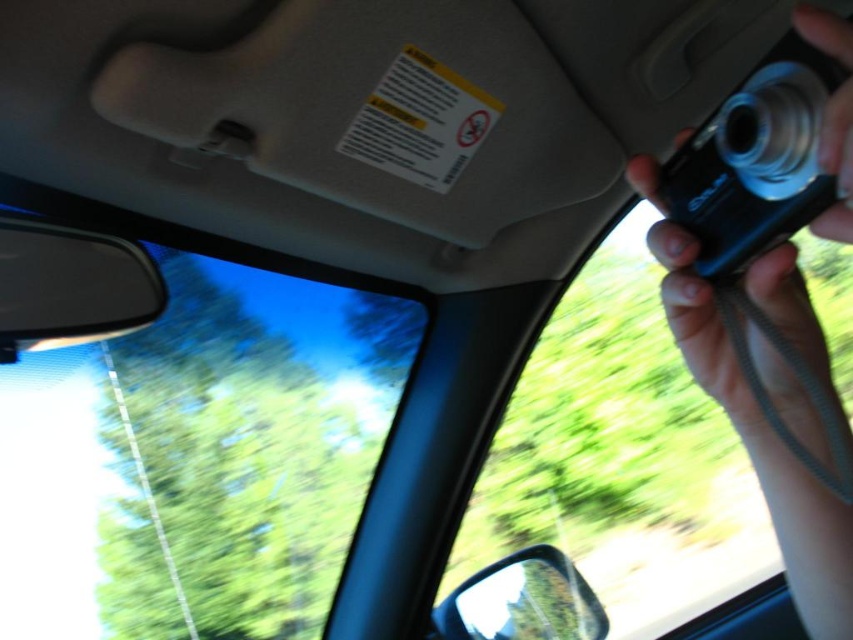
Question: Which object appears farthest from the camera in this image?

Choices:
 (A) transparent plastic car window at right
 (B) transparent glass car window at upper left
 (C) black plastic camera at right

Answer: (A)

Question: Considering the real-world distances, which object is closest to the transparent glass car window at upper left?

Choices:
 (A) shiny silver mirror at lower right
 (B) black plastic camera at upper right
 (C) transparent plastic car window at right
 (D) black plastic car mirror at left

Answer: (A)

Question: Which point is farther to the camera?

Choices:
 (A) (561, 336)
 (B) (462, 588)
 (C) (178, 276)
 (D) (837, 547)

Answer: (A)

Question: From the image, what is the correct spatial relationship of transparent glass car window at upper left in relation to black plastic car mirror at left?

Choices:
 (A) above
 (B) below

Answer: (B)

Question: Is the position of transparent plastic car window at right more distant than that of shiny silver mirror at lower right?

Choices:
 (A) yes
 (B) no

Answer: (A)

Question: Can you confirm if black plastic camera at upper right is positioned above black plastic car mirror at left?

Choices:
 (A) yes
 (B) no

Answer: (A)